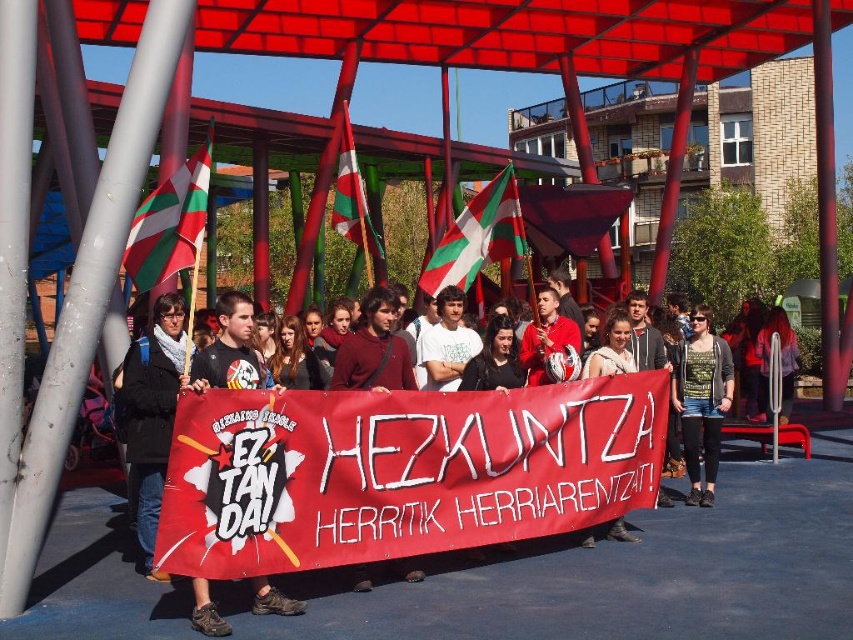
Question: Is matte black jacket at center above red fabric banner at center?

Choices:
 (A) yes
 (B) no

Answer: (A)

Question: Which point is closer to the camera?

Choices:
 (A) (190, 456)
 (B) (370, 232)
 (C) (251, 516)
 (D) (689, 342)

Answer: (A)

Question: Does black fabric jacket at center have a larger size compared to white and green striped flag at center?

Choices:
 (A) yes
 (B) no

Answer: (B)

Question: Which point is closer to the camera taking this photo?

Choices:
 (A) (695, 358)
 (B) (462, 276)
 (C) (200, 163)
 (D) (564, 426)

Answer: (C)

Question: Which is farther from the black fabric banner at center?

Choices:
 (A) black fabric jacket at center
 (B) green-white-red striped flag at left
 (C) white and green striped flag at center

Answer: (C)

Question: Is matte black jacket at center bigger than black fabric jacket at center?

Choices:
 (A) yes
 (B) no

Answer: (A)